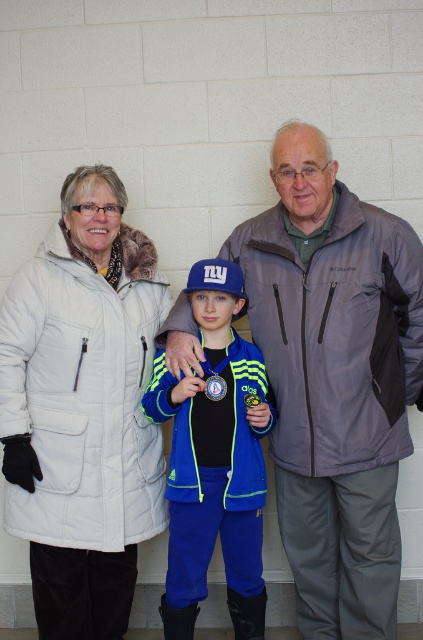
Who is taller, gray softshell jacket at center or blue fleece jacket at center?

Standing taller between the two is gray softshell jacket at center.

Locate an element on the screen. gray softshell jacket at center is located at coordinates (335, 380).

Does white puffy coat at left appear on the right side of blue fleece jacket at center?

Incorrect, white puffy coat at left is not on the right side of blue fleece jacket at center.

In the scene shown: Does white puffy coat at left have a greater height compared to blue fleece jacket at center?

Yes, white puffy coat at left is taller than blue fleece jacket at center.

Is point (74, 173) positioned after point (236, 604)?

That is False.

Where is `white puffy coat at left`? The image size is (423, 640). white puffy coat at left is located at coordinates (82, 410).

Is gray softshell jacket at center wider than white puffy coat at left?

Indeed, gray softshell jacket at center has a greater width compared to white puffy coat at left.

Between gray softshell jacket at center and white puffy coat at left, which one has less height?

white puffy coat at left

Is point (335, 630) farther from viewer compared to point (35, 291)?

That is True.

Locate an element on the screen. Image resolution: width=423 pixels, height=640 pixels. gray softshell jacket at center is located at coordinates (x=335, y=380).